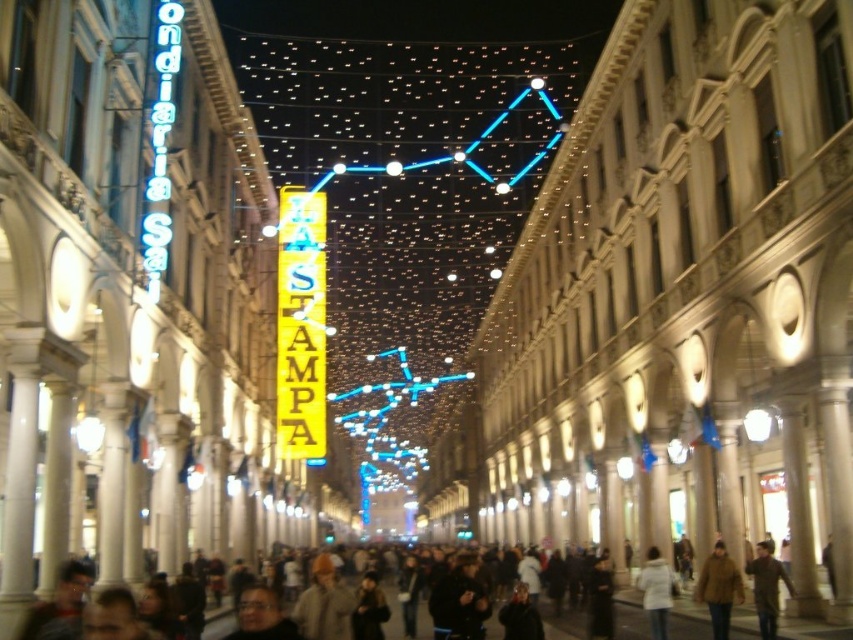
You are standing in the middle of the shopping arcade and see two points in the image. The first point is at coordinates point [291,408] and the second is at point [643,618]. Which point is closer to you?

Point [291,408] is further to the camera than point [643,618], so the point closer to you is point [643,618].

You are a store manager organizing a display in the center of a European shopping arcade. You have two coats to place on a single mannequin stand that can only hold one coat at a time. The brown leather coat at center and the white matte coat at center are both candidates. Based on their sizes, which coat should you choose to ensure it fits properly on the stand?

The brown leather coat at center occupies less space than the white matte coat at center, so it is the better choice to ensure it fits properly on the stand.